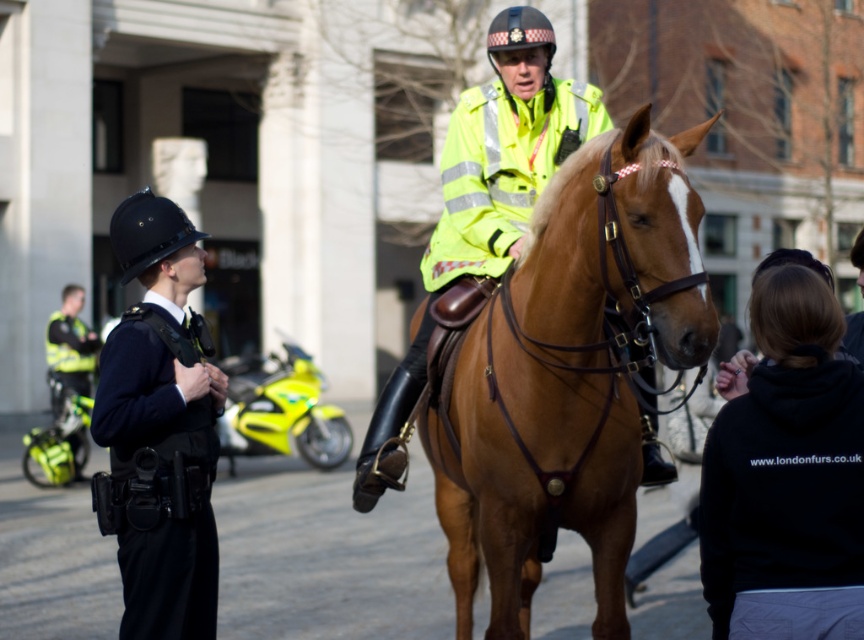
Is point (810, 291) behind point (553, 170)?

No.

Which is behind, point (837, 406) or point (405, 365)?

Point (405, 365)

Does point (729, 410) come farther from viewer compared to point (512, 172)?

No, it is in front of (512, 172).

This screenshot has height=640, width=864. I want to click on black fleece at lower right, so click(786, 476).

Does point (633, 419) lie behind point (845, 403)?

That is True.

Can you confirm if brown leather horse at center is smaller than black fleece at lower right?

Incorrect, brown leather horse at center is not smaller in size than black fleece at lower right.

The width and height of the screenshot is (864, 640). Describe the element at coordinates (569, 376) in the screenshot. I see `brown leather horse at center` at that location.

This screenshot has height=640, width=864. Identify the location of brown leather horse at center. (569, 376).

Does brown leather horse at center have a larger size compared to high-visibility yellow jacket at center?

Indeed, brown leather horse at center has a larger size compared to high-visibility yellow jacket at center.

Who is taller, brown leather horse at center or high-visibility yellow jacket at center?

brown leather horse at center

Who is more forward, (689, 360) or (540, 22)?

Positioned in front is point (689, 360).

You are a GUI agent. You are given a task and a screenshot of the screen. Output one action in this format:
    pyautogui.click(x=<x>, y=<y>)
    Task: Click on the brown leather horse at center
    Image resolution: width=864 pixels, height=640 pixels.
    Given the screenshot: What is the action you would take?
    pyautogui.click(x=569, y=376)